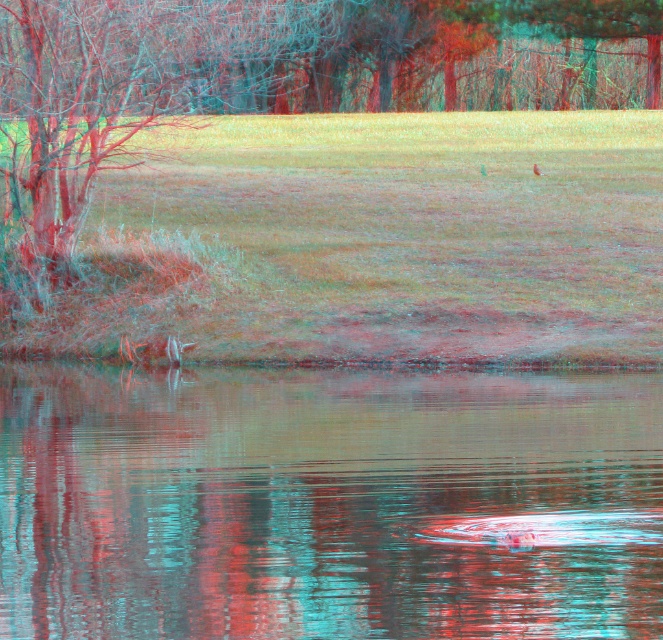
Question: Which object appears closest to the camera in this image?

Choices:
 (A) clear water at center
 (B) brown fuzzy bird at center
 (C) green grass at center

Answer: (A)

Question: Which is nearer to the brown fuzzy bird at center?

Choices:
 (A) clear water at center
 (B) green grass at center

Answer: (B)

Question: Is green grass at center to the right of brown fuzzy bird at center from the viewer's perspective?

Choices:
 (A) no
 (B) yes

Answer: (A)

Question: Which point is closer to the camera?

Choices:
 (A) (538, 173)
 (B) (343, 380)

Answer: (B)

Question: Is clear water at center bigger than brown fuzzy bird at center?

Choices:
 (A) no
 (B) yes

Answer: (B)

Question: Does clear water at center appear under brown fuzzy bird at center?

Choices:
 (A) yes
 (B) no

Answer: (A)